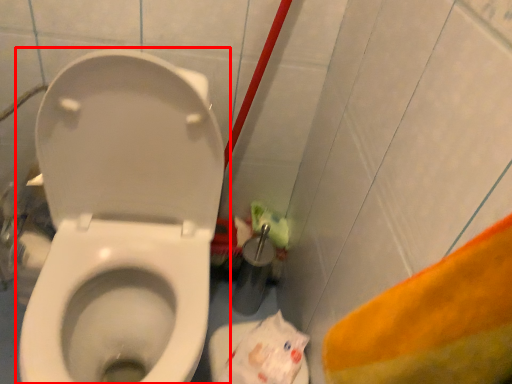
Question: From the image's perspective, what is the correct spatial relationship of toilet (annotated by the red box) in relation to paper bag?

Choices:
 (A) below
 (B) above

Answer: (B)